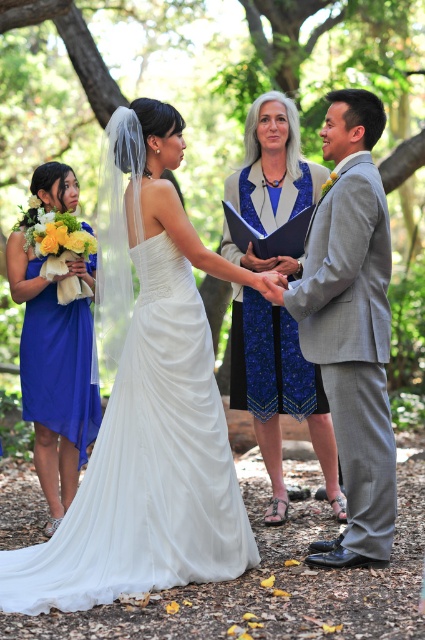
You are standing at the point marked as point [163,435] during the wedding ceremony. The photographer wants to take a photo of the bride and groom from your current position. If the photographer is standing where you are, will they be able to capture both the bride and groom in the frame without moving?

The photographer is 4.93 meters away from the point [163,435] where they are standing. Since the bride and groom are positioned centrally and opposite each other, the photographer can likely capture both in the frame as they are the central focus of the image. However, the exact framing depends on the camera lens used. If the lens has a wide enough angle, they should fit. The given distance doesnecessary to determine this, but based on typical wedding photography setups, it is feasible.

You are a photographer at the wedding ceremony. You want to take a photo that includes both the point at location (48, 600) and the point at (331, 212). Since you want the closer point to be in focus, which point should you focus on?

Point (48, 600) is closer to the viewer than point (331, 212), so you should focus on point (48, 600) to ensure it is in focus.

Based on the photo, you are a photographer at a wedding and need to frame the couple in a way that both the white satin dress at center and the gray textured suit at right are visible. Considering their sizes, which one might require more space in the frame?

The white satin dress at center requires more space in the frame since its width surpasses that of the gray textured suit at right.